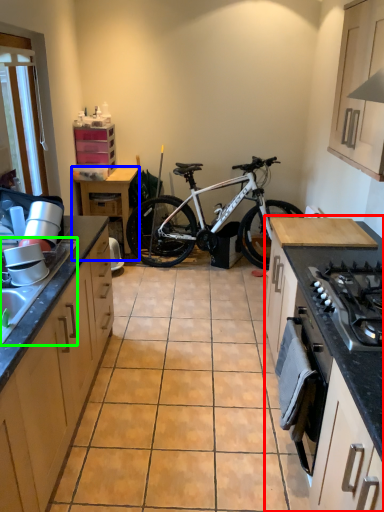
Question: Estimate the real-world distances between objects in this image. Which object is farther from countertop (highlighted by a red box), table (highlighted by a blue box) or sink (highlighted by a green box)?

Choices:
 (A) table
 (B) sink

Answer: (A)